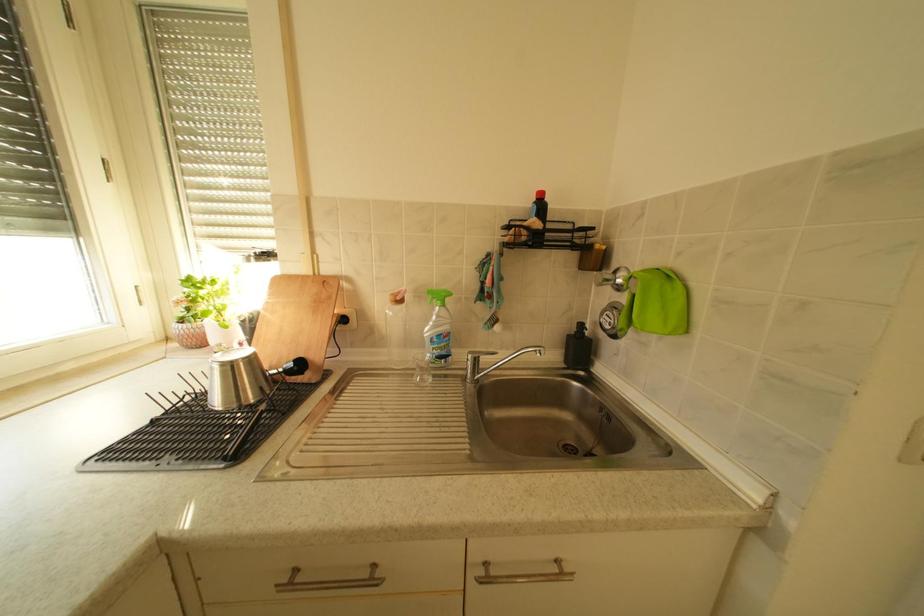
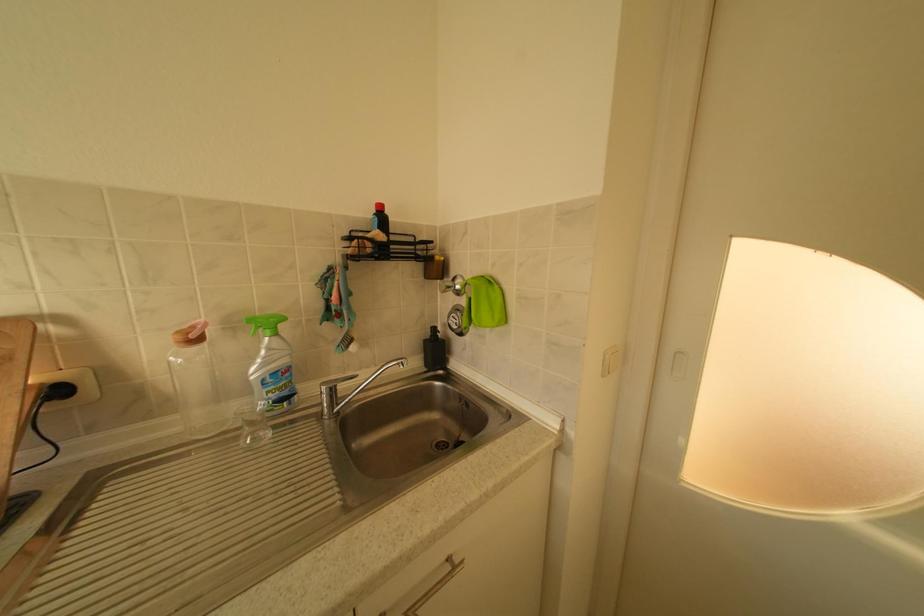
Question: The camera is either moving clockwise (left) or counter-clockwise (right) around the object. The first image is from the beginning of the video and the second image is from the end. Is the camera moving left or right when shooting the video?

Choices:
 (A) Left
 (B) Right

Answer: (A)